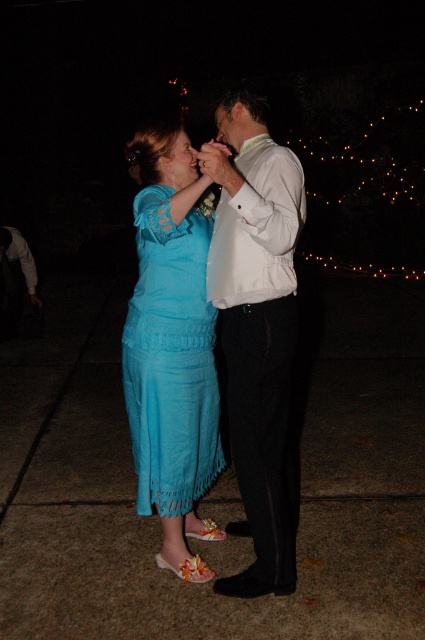
In the scene shown: You are a photographer taking a picture of two people standing close together at night. You notice two points in the scene labeled as point (280, 237) and point (210, 276). Which point is closer to the camera?

Point (280, 237) is in front of point (210, 276), so it is closer to the camera.

You are a photographer setting up a backdrop for a portrait. You have two shirts available for the subjects to wear. The first is a white satin shirt at center and the second is a white satin dress shirt at center. Based on the scene description, which shirt would you recommend to ensure it fits comfortably over the subject wearing the dark tie?

The white satin shirt at center is wider than the white satin dress shirt at center, so the white satin shirt at center would be more comfortable for the subject wearing the dark tie as it provides more room.

You are a photographer trying to capture a clear shot of both the white satin shirt at center and the white satin dress shirt at center. Since they are close together, you need to adjust your focus. Which one should you focus on first to ensure the topmost part is sharp?

The white satin dress shirt at center is positioned above the white satin shirt at center, so focusing on the white satin dress shirt at center first will ensure its topmost part is sharp.